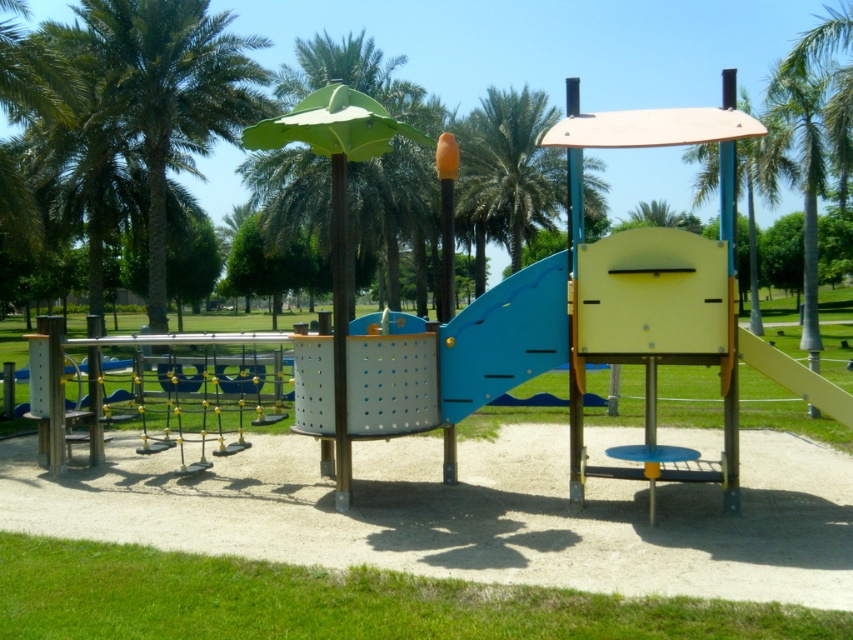
You are standing at the center of the playground and see the point marked at coordinates (x=509, y=166). What object is located at that point?

The point at coordinates (x=509, y=166) corresponds to the green leafy palm tree at center.

You are a child standing in the playground and want to reach the slide. There are two green leafy palm trees in the background. Which palm tree is closer to you, the green leafy palm tree at upper left or the green leafy palm tree at upper right?

The green leafy palm tree at upper left is closer to you because it is further to the viewer than the green leafy palm tree at upper right, meaning it appears nearer in the scene.